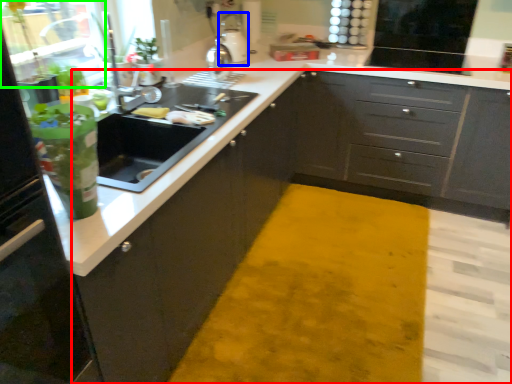
Question: Which object is positioned farthest from cabinetry (highlighted by a red box)? Select from appliance (highlighted by a blue box) and glass door (highlighted by a green box).

Choices:
 (A) appliance
 (B) glass door

Answer: (B)